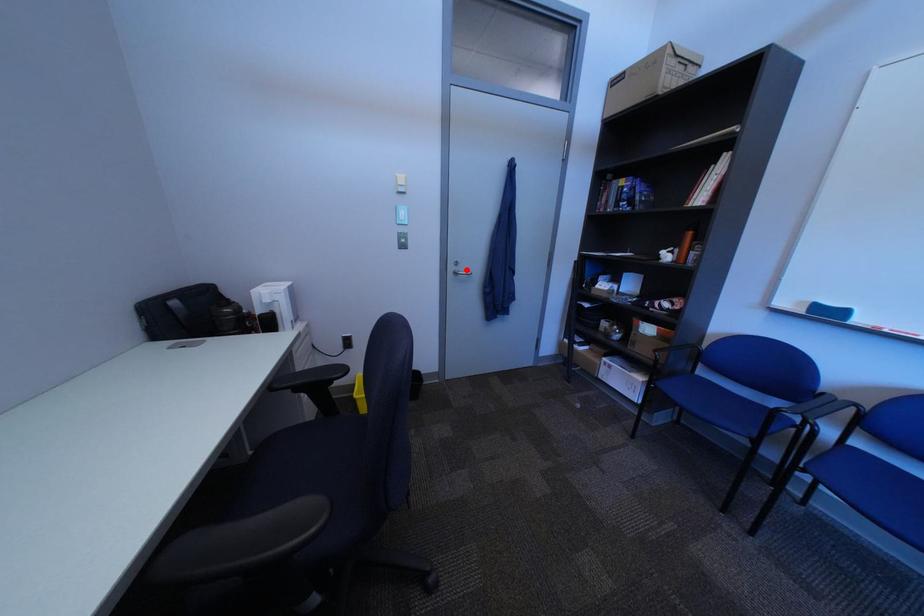
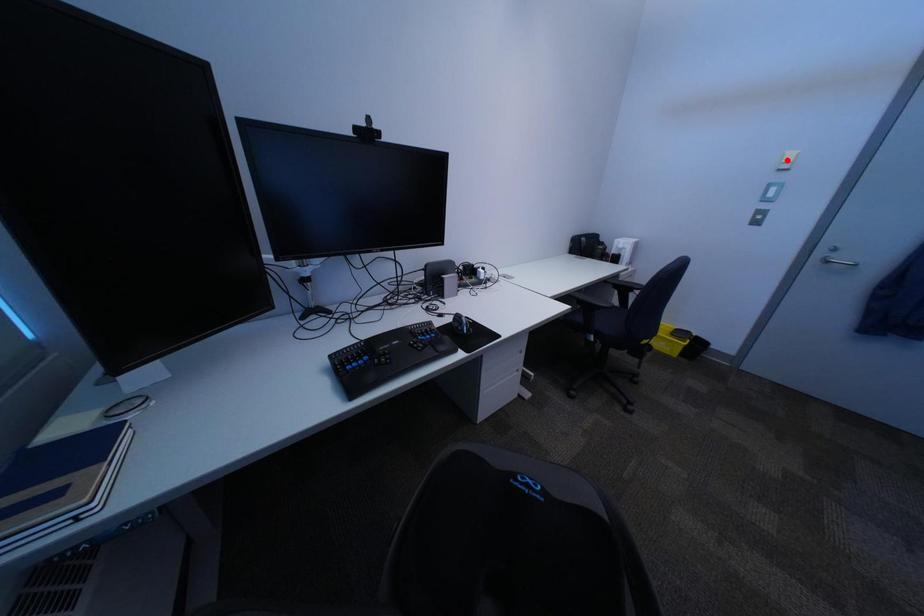
I am providing you with two images of the same scene from different viewpoints. A red point is marked on the first image and another point is marked on the second image. Do the highlighted points in image1 and image2 indicate the same real-world spot?

No